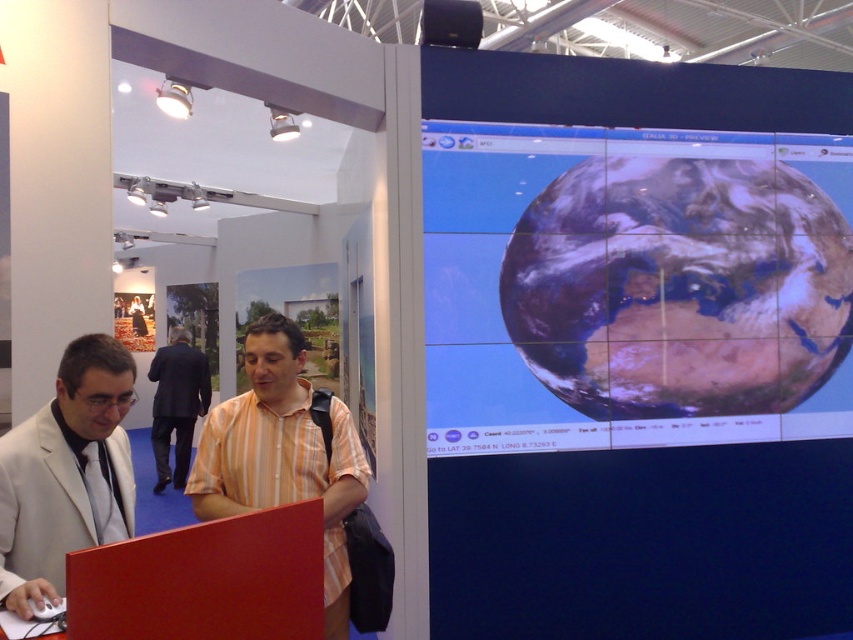
Question: Which is farther from the smooth glossy earth at right?

Choices:
 (A) orange striped shirt at center
 (B) matte white suit at left

Answer: (B)

Question: Can you confirm if matte white suit at left is bigger than dark suit at center?

Choices:
 (A) no
 (B) yes

Answer: (A)

Question: Which object is farther from the camera taking this photo?

Choices:
 (A) orange striped shirt at center
 (B) dark suit at center

Answer: (B)

Question: Can you confirm if smooth glossy earth at right is wider than orange striped shirt at center?

Choices:
 (A) yes
 (B) no

Answer: (A)

Question: Which object appears farthest from the camera in this image?

Choices:
 (A) smooth glossy earth at right
 (B) orange striped shirt at center

Answer: (A)

Question: Does smooth glossy earth at right appear on the left side of dark suit at center?

Choices:
 (A) yes
 (B) no

Answer: (B)